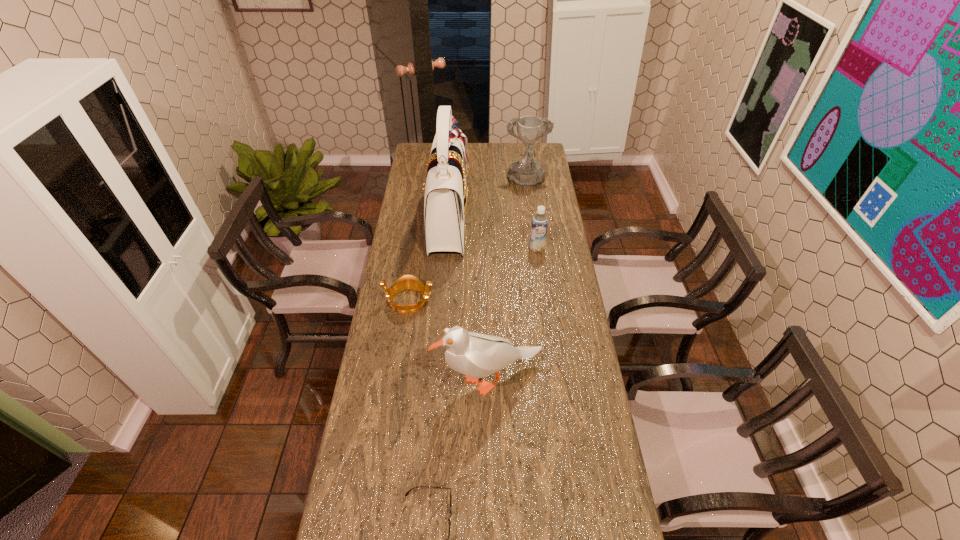
Identify the location of vacant space located 0.170m at the beak of the second nearest object. This screenshot has width=960, height=540. pyautogui.click(x=385, y=380).

The image size is (960, 540). Find the location of `free space located on the label of the soya milk`. free space located on the label of the soya milk is located at coordinates (543, 300).

At what (x,y) coordinates should I click in order to perform the action: click on vacant space situated 0.180m at the front emblem of the tiara. Please return your answer as a coordinate pair (x, y). This screenshot has height=540, width=960. Looking at the image, I should click on (481, 301).

I want to click on satchel that is at the left edge, so click(x=446, y=196).

Identify the location of tiara situated at the left edge. This screenshot has width=960, height=540. (408, 282).

Where is `award that is at the right edge`? The image size is (960, 540). award that is at the right edge is located at coordinates (527, 172).

This screenshot has width=960, height=540. Identify the location of soya milk positioned at the right edge. (539, 223).

You are a GUI agent. You are given a task and a screenshot of the screen. Output one action in this format:
    pyautogui.click(x=<x>, y=<y>)
    Task: Click on the free space at the left edge of the desktop
    This screenshot has height=540, width=960.
    Given the screenshot: What is the action you would take?
    pyautogui.click(x=410, y=296)

Find the location of `free spot at the right edge of the desktop`. free spot at the right edge of the desktop is located at coordinates (546, 316).

This screenshot has height=540, width=960. Identify the location of vacant space at the far left corner of the desktop. (424, 160).